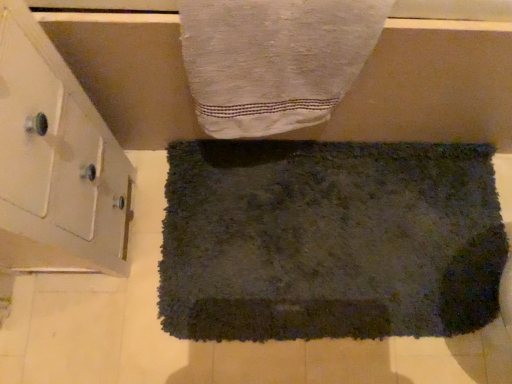
The image size is (512, 384). I want to click on free area in between white glossy cabinet at left and dark gray shaggy rug at center, which appears as the 1th towel when ordered from the bottom, so click(130, 263).